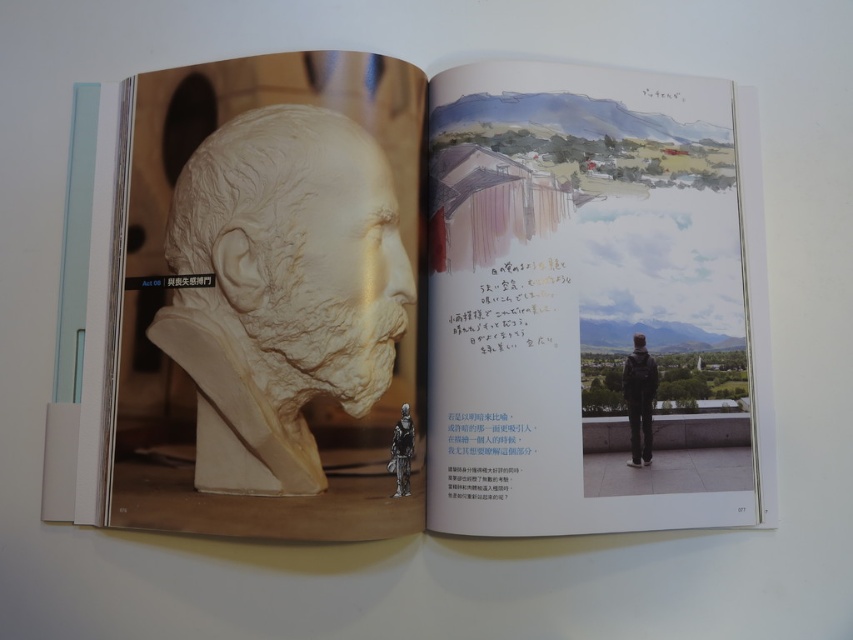
Who is lower down, white clay bust at left or dark gray backpack at center?

dark gray backpack at center

This screenshot has height=640, width=853. Describe the element at coordinates (425, 300) in the screenshot. I see `white clay bust at left` at that location.

Identify the location of white clay bust at left. Image resolution: width=853 pixels, height=640 pixels. (425, 300).

Does white clay bust at center-left appear over dark gray backpack at center?

Yes.

What do you see at coordinates (282, 291) in the screenshot?
I see `white clay bust at center-left` at bounding box center [282, 291].

Locate an element on the screen. The image size is (853, 640). white clay bust at center-left is located at coordinates (282, 291).

From the picture: Which is more to the left, white clay bust at center-left or metallic silver armor at center?

white clay bust at center-left is more to the left.

Is white clay bust at center-left taller than metallic silver armor at center?

Correct, white clay bust at center-left is much taller as metallic silver armor at center.

Between point (245, 192) and point (405, 413), which one is positioned behind?

The point (245, 192) is more distant.

I want to click on white clay bust at center-left, so click(x=282, y=291).